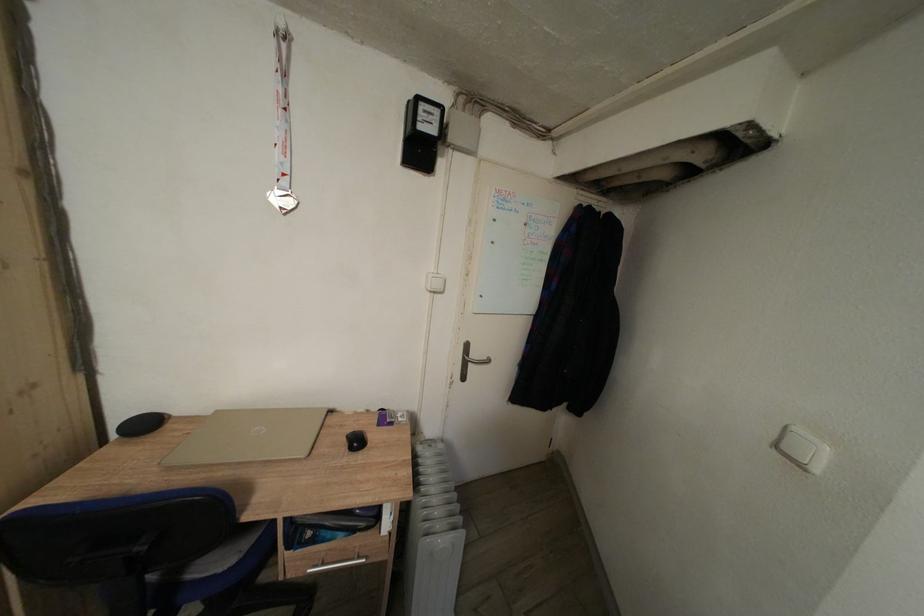
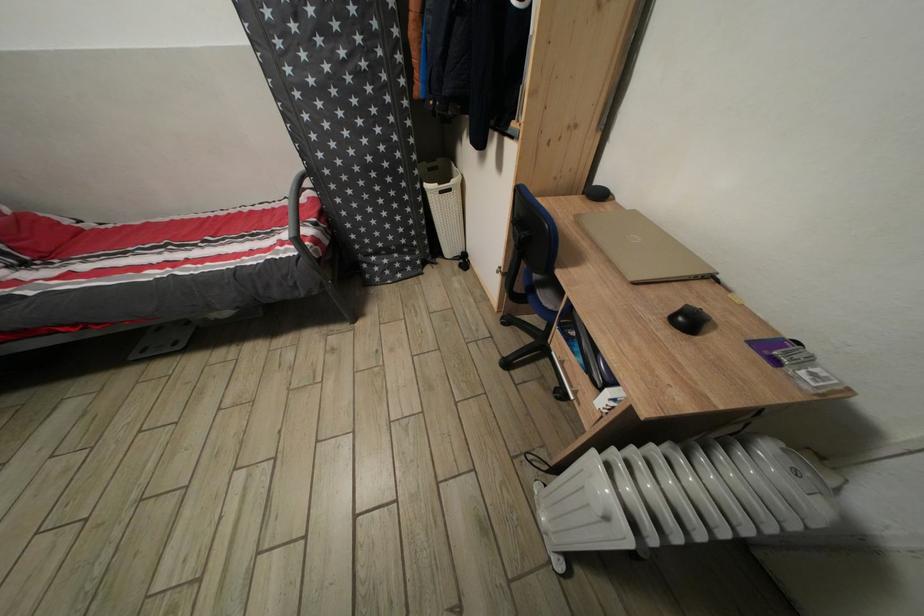
The point at (x=363, y=448) is marked in the first image. Where is the corresponding point in the second image?

(696, 328)